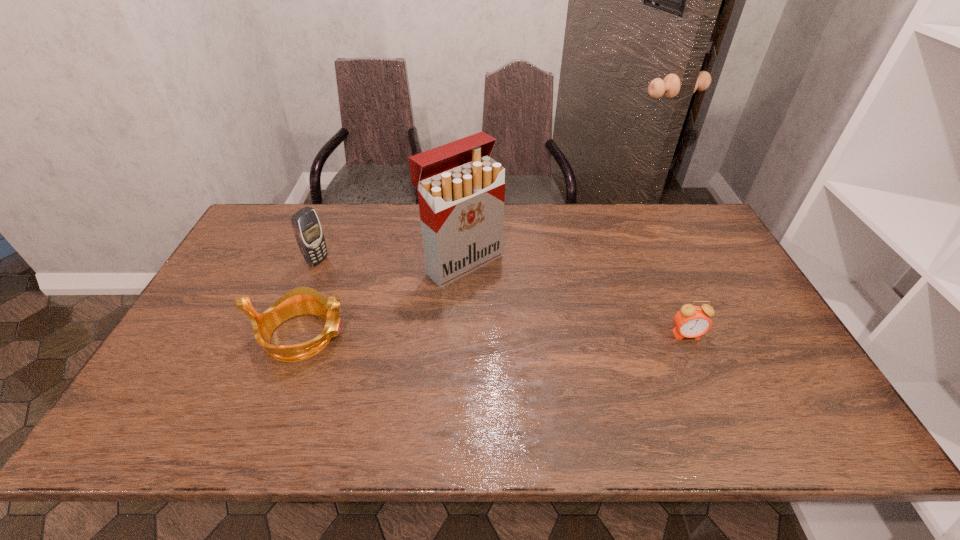
In order to click on free space on the desktop that is between the tiara and the rightmost object and is positioned on the front face of the cellular telephone in this screenshot , I will do `click(484, 335)`.

The image size is (960, 540). In order to click on free spot on the desktop that is between the tiara and the alarm clock and is positioned with the lid open on the cigarette case in this screenshot , I will do `click(547, 335)`.